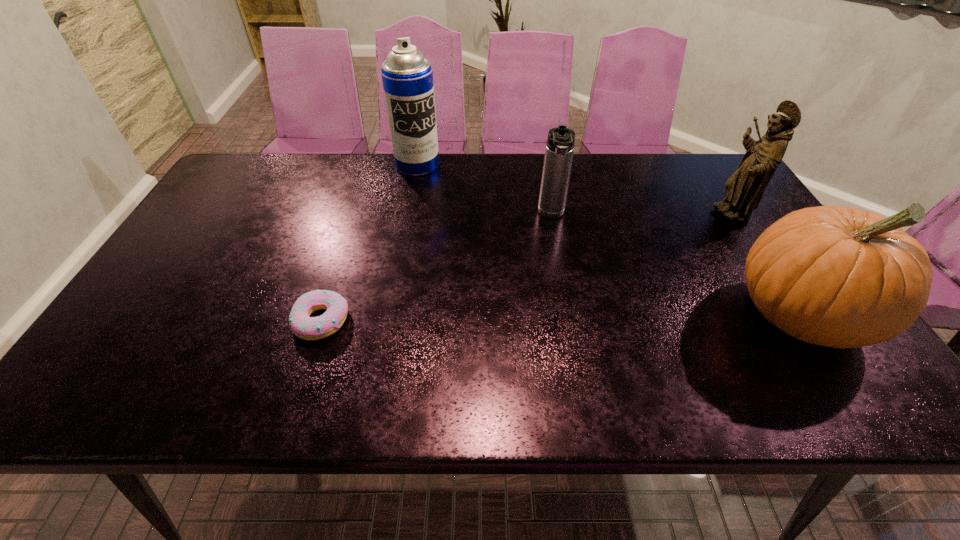
The width and height of the screenshot is (960, 540). Find the location of `the leftmost object`. the leftmost object is located at coordinates (308, 328).

Where is `doughnut`? The width and height of the screenshot is (960, 540). doughnut is located at coordinates (308, 328).

I want to click on pumpkin, so click(842, 277).

Where is `the fourth tallest object`? The width and height of the screenshot is (960, 540). the fourth tallest object is located at coordinates (560, 143).

Where is `thermos bottle`? thermos bottle is located at coordinates (560, 143).

Find the location of a particular element. figurine is located at coordinates (743, 191).

Locate an element on the screen. This screenshot has height=540, width=960. the farthest object is located at coordinates (407, 76).

In order to click on the fourth object from right to left in this screenshot , I will do `click(407, 76)`.

Identify the location of vacant space situated 0.270m on the back of the leftmost object. (351, 227).

The image size is (960, 540). What are the coordinates of `free space located 0.300m on the handle side of the second shortest object` in the screenshot? It's located at (556, 310).